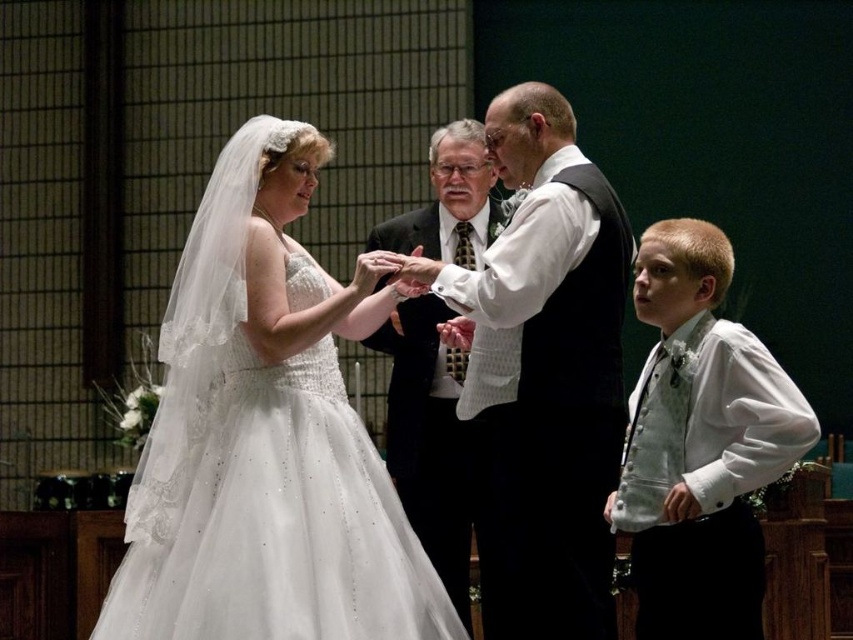
Which is in front, point (138, 545) or point (648, 276)?

Point (138, 545) is in front.

Can you confirm if white satin dress at center is positioned to the left of white satin vest at right?

Yes, white satin dress at center is to the left of white satin vest at right.

Is point (364, 483) more distant than point (653, 241)?

That is False.

Find the location of `white satin dress at center`. white satin dress at center is located at coordinates (267, 435).

You are a GUI agent. You are given a task and a screenshot of the screen. Output one action in this format:
    pyautogui.click(x=<x>, y=<y>)
    Task: Click on the white satin vest at right
    
    Given the screenshot: What is the action you would take?
    pyautogui.click(x=700, y=444)

The width and height of the screenshot is (853, 640). I want to click on white satin vest at right, so click(700, 444).

Which is more to the right, white satin dress at center or matte black suit at center?

From the viewer's perspective, matte black suit at center appears more on the right side.

You are a GUI agent. You are given a task and a screenshot of the screen. Output one action in this format:
    pyautogui.click(x=<x>, y=<y>)
    Task: Click on the white satin dress at center
    
    Given the screenshot: What is the action you would take?
    pyautogui.click(x=267, y=435)